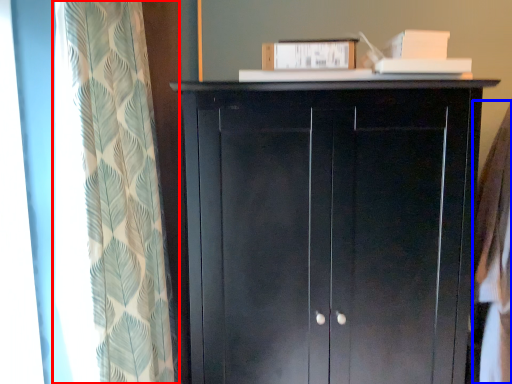
Question: Which of the following is the closest to the observer, curtain (highlighted by a red box) or clothing (highlighted by a blue box)?

Choices:
 (A) curtain
 (B) clothing

Answer: (A)